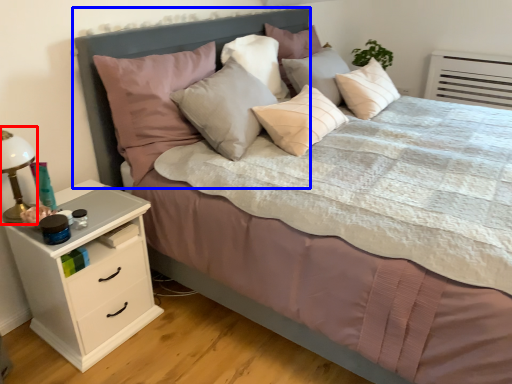
Question: Which point is further to the camera, bedside lamp (highlighted by a red box) or headboard (highlighted by a blue box)?

Choices:
 (A) bedside lamp
 (B) headboard

Answer: (B)